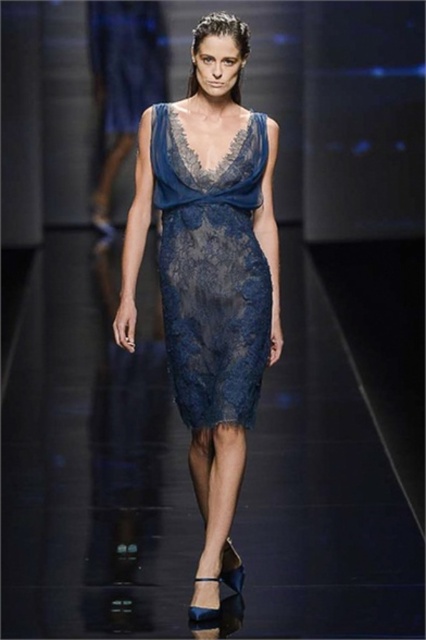
Question: Which of the following is the closest to the observer?

Choices:
 (A) (189, 145)
 (B) (112, 20)

Answer: (A)

Question: Which of the following is the farthest from the observer?

Choices:
 (A) navy lace dress at center
 (B) lace dress at center

Answer: (B)

Question: Considering the relative positions of navy lace dress at center and lace fabric dress at center in the image provided, where is navy lace dress at center located with respect to lace fabric dress at center?

Choices:
 (A) below
 (B) above

Answer: (A)

Question: Does navy lace dress at center have a greater width compared to lace fabric dress at center?

Choices:
 (A) yes
 (B) no

Answer: (B)

Question: Is navy lace dress at center to the right of lace fabric dress at center from the viewer's perspective?

Choices:
 (A) yes
 (B) no

Answer: (A)

Question: Which point is closer to the camera?

Choices:
 (A) (104, 13)
 (B) (230, 317)

Answer: (B)